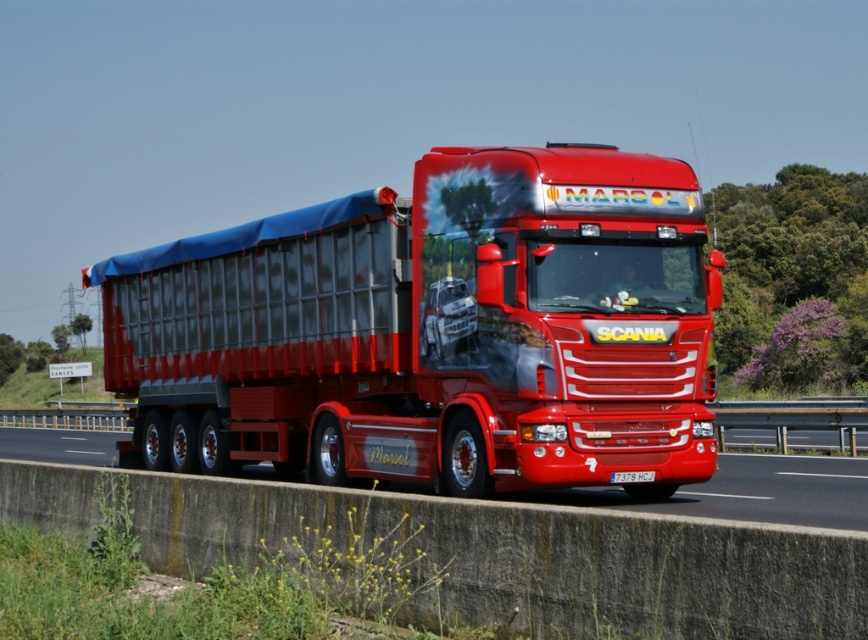
You are a photographer trying to capture the white plastic license plate at center of the red Scania truck. However, the metallic asphalt at center is blocking your view. Can you adjust your position to see the license plate without moving the truck?

The metallic asphalt at center is closer to the viewer than the white plastic license plate at center, so you can move your position to a higher angle or shift sideways to see above or around the metallic asphalt at center and view the white plastic license plate at center.

You are a driver in a car that is 2 meters wide. You are driving on the highway and see the truck with the Marsol logo. There is a metallic silver trailer at center represented by point (435, 330). Can you safely pass the truck without crossing the center line?

The metallic silver trailer at center is located at point (435, 330), which is in the center of the highway. Since the highway has multiple lanes, you can safely pass the truck by staying in your lane without crossing the center line.